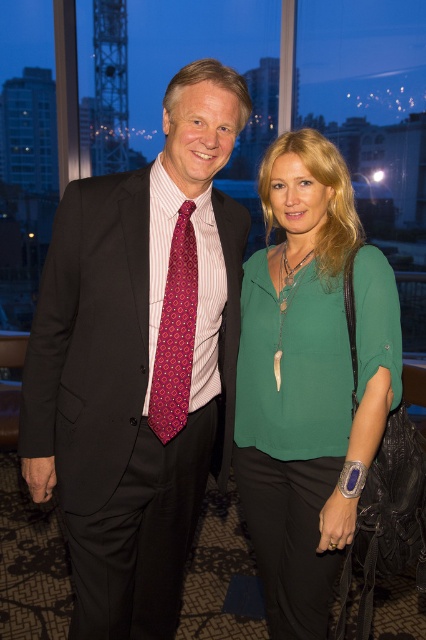
Question: Is matte black suit at center to the right of green silk blouse at center from the viewer's perspective?

Choices:
 (A) yes
 (B) no

Answer: (B)

Question: Which of these objects is positioned farthest from the green silk blouse at center?

Choices:
 (A) dark pink textured tie at center
 (B) matte black suit at center

Answer: (A)

Question: Estimate the real-world distances between objects in this image. Which object is farther from the dark pink textured tie at center?

Choices:
 (A) green silk blouse at center
 (B) matte black suit at center

Answer: (A)

Question: Is green silk blouse at center bigger than dark pink textured tie at center?

Choices:
 (A) no
 (B) yes

Answer: (B)

Question: Based on their relative distances, which object is farther from the dark pink textured tie at center?

Choices:
 (A) green silk blouse at center
 (B) matte black suit at center

Answer: (A)

Question: In this image, where is green silk blouse at center located relative to dark pink textured tie at center?

Choices:
 (A) below
 (B) above

Answer: (A)